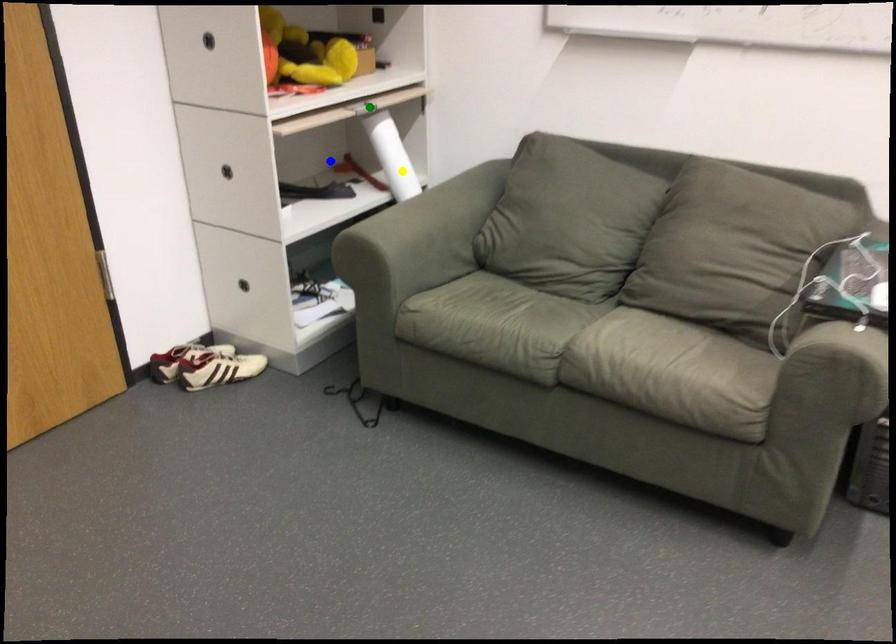
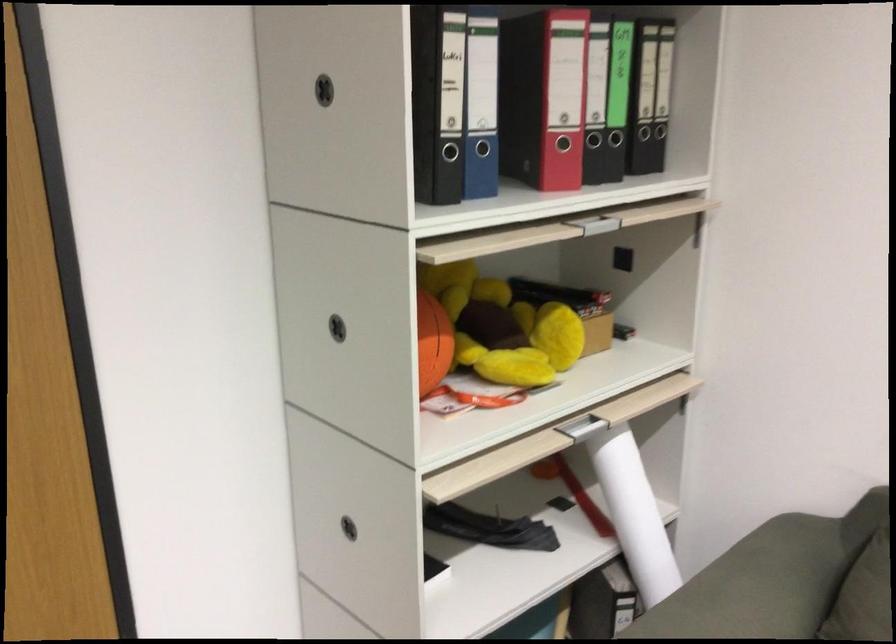
I am providing you with two images of the same scene from different viewpoints. Three points are marked in image1. Which point corresponds to a part or object that is occluded in image2?In image1, three points are marked. Which of them correspond to a part or object that is occluded in image2?Among the three points shown in image1, which one corresponds to a part or object that is no longer visible due to occlusion in image2?

blue point cannot be seen in image2.